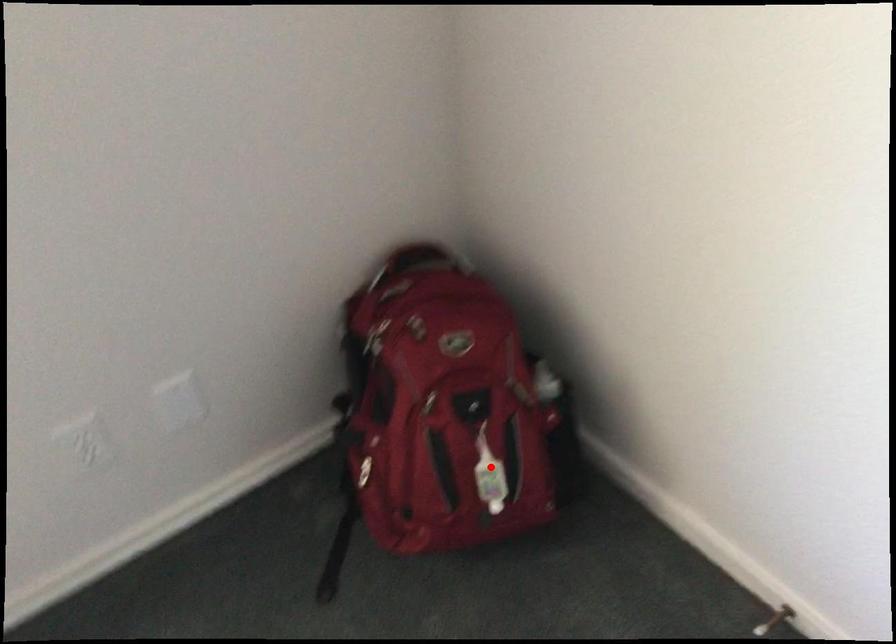
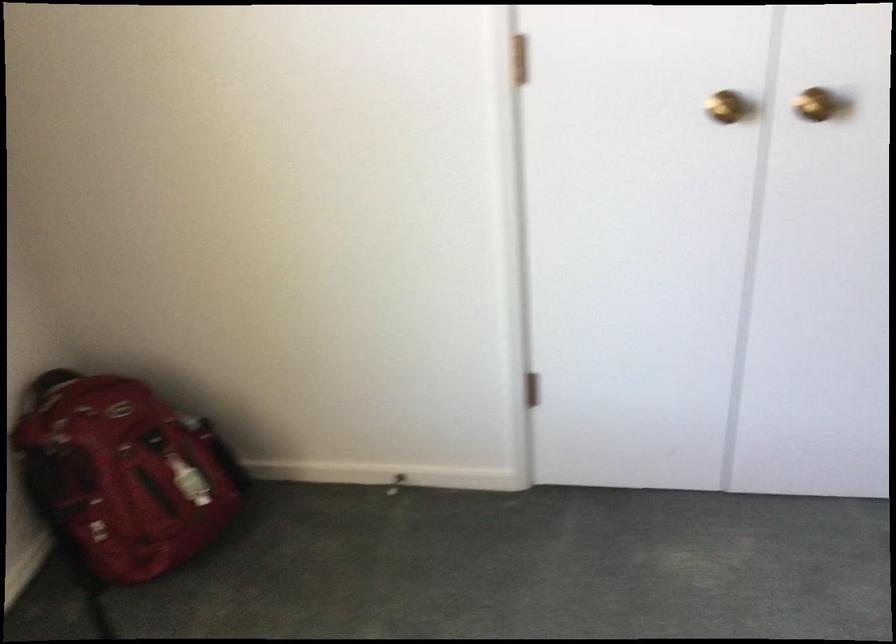
Question: I am providing you with two images of the same scene from different viewpoints. A red point is marked on the first image. Can you still see the location of the red point in image 2?

Choices:
 (A) Yes
 (B) No

Answer: (A)